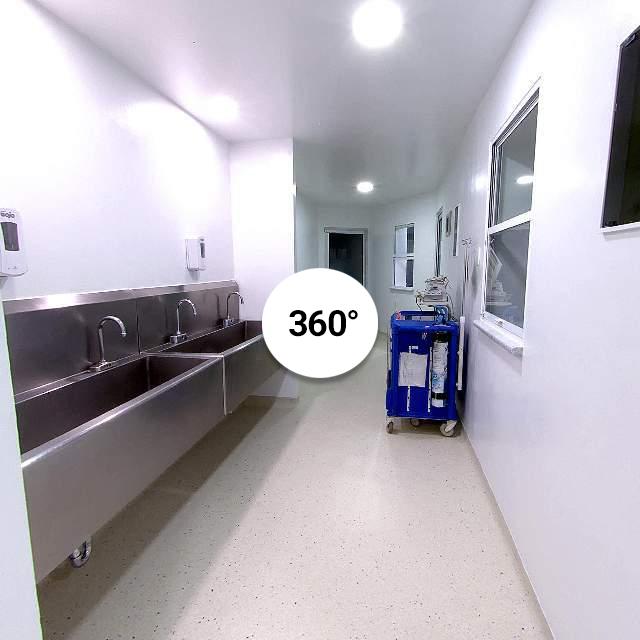
Identify the location of hand soap. Image resolution: width=640 pixels, height=640 pixels. (18, 246), (195, 258).